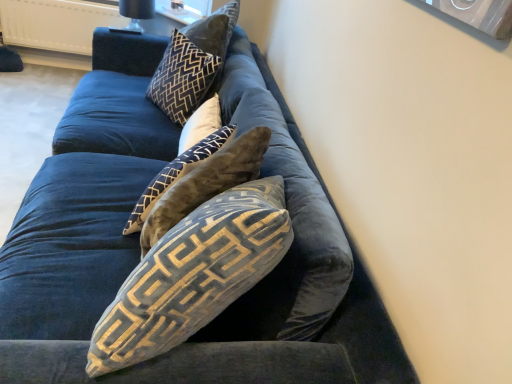
Question: Would you say velvet brown pillow at center, the 3th pillow when ordered from front to back, is inside or outside velvet beige pillow at center, which is the second pillow in front-to-back order?

Choices:
 (A) outside
 (B) inside

Answer: (A)

Question: Looking at their shapes, would you say velvet brown pillow at center, which appears as the second pillow when viewed from the back, is wider or thinner than velvet beige pillow at center, the third pillow in the back-to-front sequence?

Choices:
 (A) wide
 (B) thin

Answer: (B)

Question: Which object is the farthest from the velvet gold-patterned pillow at center, acting as the 1th pillow starting from the front?

Choices:
 (A) velvet brown pillow at center, the 3th pillow when ordered from front to back
 (B) velvet beige pillow at center, which is the second pillow in front-to-back order
 (C) velvet black pillow at upper center, which is counted as the fourth pillow, starting from the front
 (D) black glass lamp at upper center

Answer: (D)

Question: Estimate the real-world distances between objects in this image. Which object is closer to the velvet beige pillow at center, which is the second pillow in front-to-back order?

Choices:
 (A) velvet black pillow at upper center, the first pillow in the back-to-front sequence
 (B) black glass lamp at upper center
 (C) velvet brown pillow at center, the 3th pillow when ordered from front to back
 (D) velvet gold-patterned pillow at center, acting as the 1th pillow starting from the front

Answer: (C)